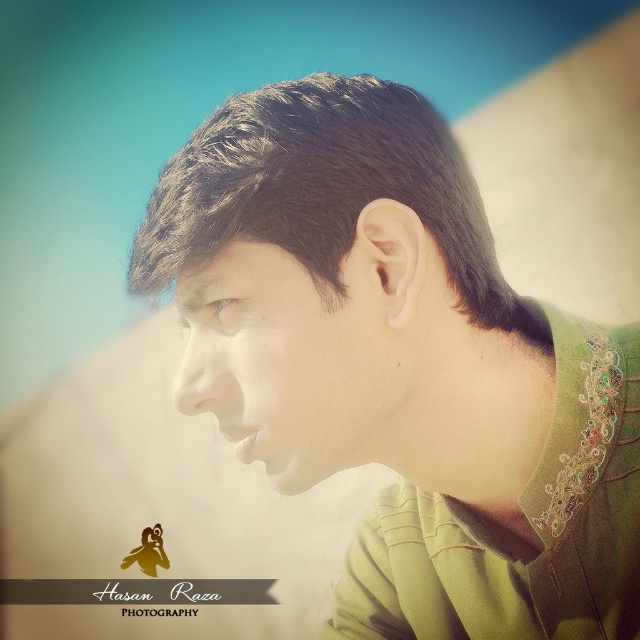
Is green embroidered shirt at center to the left of dark brown hair at center from the viewer's perspective?

No, green embroidered shirt at center is not to the left of dark brown hair at center.

Which is above, green embroidered shirt at center or dark brown hair at center?

Positioned higher is dark brown hair at center.

At what (x,y) coordinates should I click in order to perform the action: click on green embroidered shirt at center. Please return your answer as a coordinate pair (x, y). Looking at the image, I should click on (400, 364).

The image size is (640, 640). Identify the location of green embroidered shirt at center. (400, 364).

Does green embroidered shirt at center have a lesser width compared to smooth skin face at center?

No.

Measure the distance between point (232, 307) and camera.

A distance of 20.07 inches exists between point (232, 307) and camera.

The image size is (640, 640). What are the coordinates of `green embroidered shirt at center` in the screenshot? It's located at (400, 364).

Based on the photo, who is positioned more to the left, dark brown hair at center or smooth skin face at center?

Positioned to the left is smooth skin face at center.

Measure the distance between point (445, 216) and camera.

A distance of 21.25 inches exists between point (445, 216) and camera.

This screenshot has width=640, height=640. Identify the location of dark brown hair at center. (324, 189).